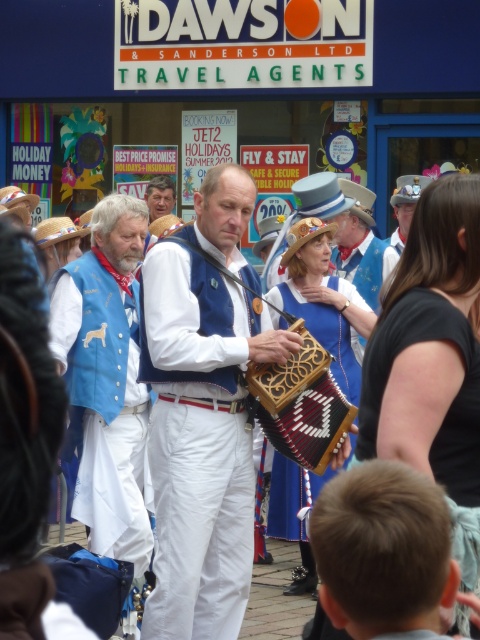
You are a photographer trying to capture the entire wooden accordion at center and blue denim vest at center in one frame. Given that your camera has a fixed field of view, which object requires you to adjust your position closer to ensure both are fully visible?

The wooden accordion at center is wider than the blue denim vest at center, so you need to move closer to ensure the wider wooden accordion at center fits within the camera frame while still capturing the blue denim vest at center.